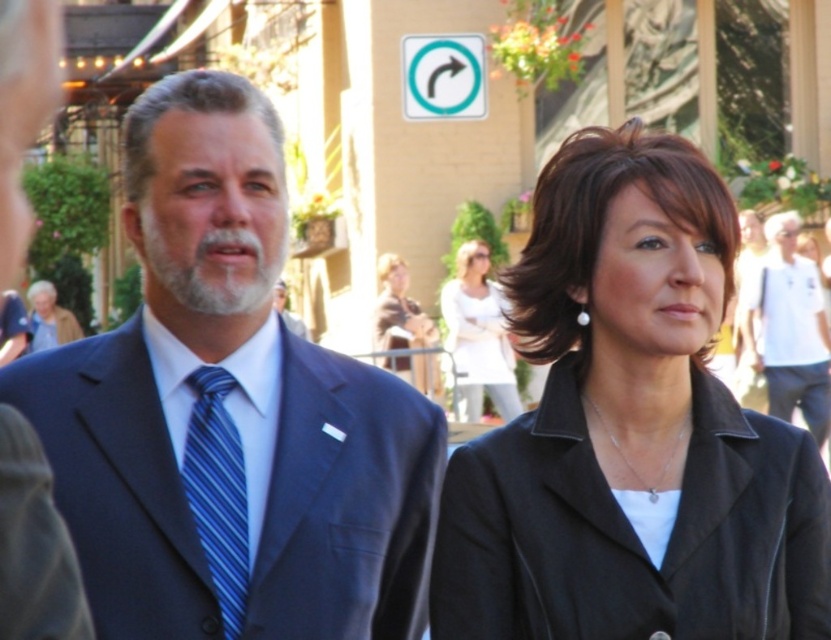
Which is below, white cotton blouse at center or teal plastic arrow at upper center?

white cotton blouse at center

Does white cotton blouse at center appear under teal plastic arrow at upper center?

Yes.

Is point (507, 362) more distant than point (440, 72)?

No.

Locate an element on the screen. The height and width of the screenshot is (640, 831). white cotton blouse at center is located at coordinates (478, 333).

Does white cotton blouse at center have a greater width compared to matte black blazer at center?

Yes.

Which of these two, white cotton blouse at center or matte black blazer at center, stands taller?

white cotton blouse at center is taller.

Does point (456, 308) come behind point (399, 321)?

No, (456, 308) is closer to viewer.

The height and width of the screenshot is (640, 831). I want to click on white cotton blouse at center, so click(x=478, y=333).

Does black matte jacket at upper right have a lesser width compared to light brown hair at lower left?

No.

Which is below, black matte jacket at upper right or light brown hair at lower left?

black matte jacket at upper right is below.

Locate an element on the screen. The height and width of the screenshot is (640, 831). black matte jacket at upper right is located at coordinates (630, 429).